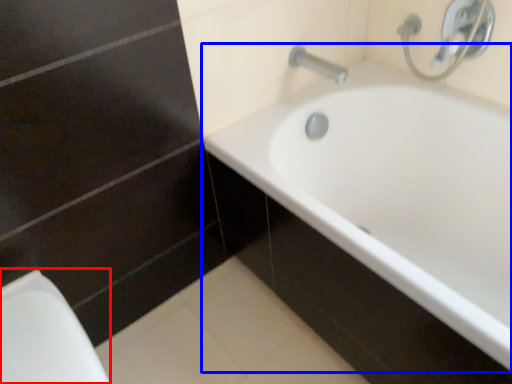
Question: Among these objects, which one is nearest to the camera, porcelain (highlighted by a red box) or bathtub (highlighted by a blue box)?

Choices:
 (A) porcelain
 (B) bathtub

Answer: (B)